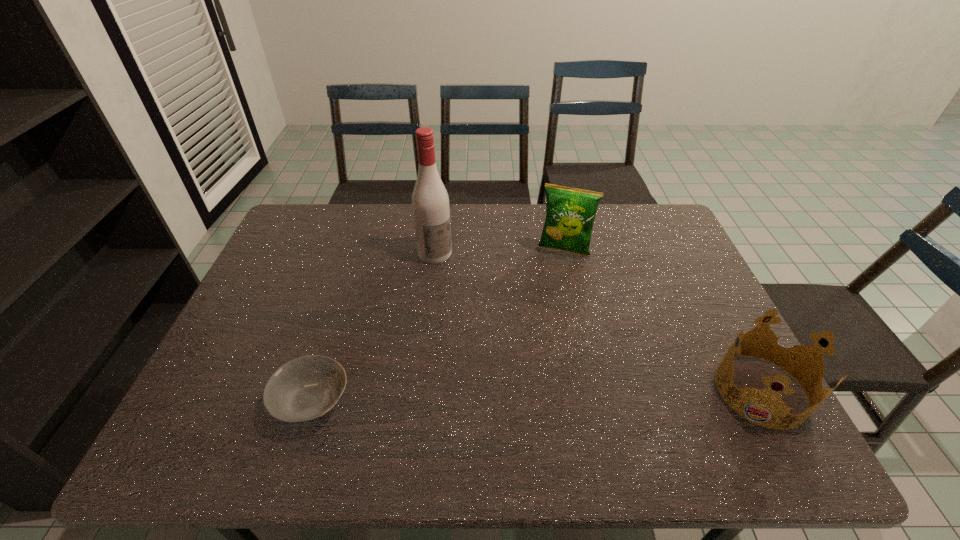
This screenshot has height=540, width=960. Identify the location of unoccupied area between the shortest object and the crown. (537, 396).

This screenshot has width=960, height=540. Find the location of `vacant area that lies between the tallest object and the crisp (potato chip)`. vacant area that lies between the tallest object and the crisp (potato chip) is located at coordinates (499, 252).

Where is `free point between the third tallest object and the alcohol`? free point between the third tallest object and the alcohol is located at coordinates (598, 322).

Locate an element on the screen. The height and width of the screenshot is (540, 960). free space between the third object from right to left and the crisp (potato chip) is located at coordinates (499, 252).

At what (x,y) coordinates should I click in order to perform the action: click on free spot between the third tallest object and the tallest object. Please return your answer as a coordinate pair (x, y). This screenshot has height=540, width=960. Looking at the image, I should click on (598, 322).

This screenshot has height=540, width=960. Identify the location of empty space between the bowl and the crisp (potato chip). (438, 327).

You are a GUI agent. You are given a task and a screenshot of the screen. Output one action in this format:
    pyautogui.click(x=<x>, y=<y>)
    Task: Click on the free space between the leftmost object and the second object from right to left
    The height and width of the screenshot is (540, 960).
    Given the screenshot: What is the action you would take?
    pyautogui.click(x=438, y=327)

Where is `the third closest object to the bowl`? The width and height of the screenshot is (960, 540). the third closest object to the bowl is located at coordinates coord(810,353).

Image resolution: width=960 pixels, height=540 pixels. Find the location of `object that is the closest to the third tallest object`. object that is the closest to the third tallest object is located at coordinates (570, 213).

This screenshot has height=540, width=960. I want to click on vacant area in the image that satisfies the following two spatial constraints: 1. on the back side of the third object from left to right; 2. on the left side of the shortest object, so click(359, 251).